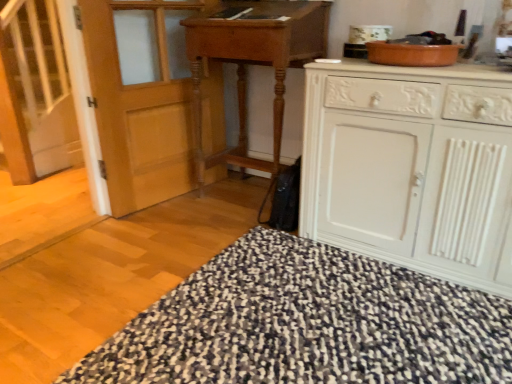
Question: Is the position of wooden table at center more distant than that of white painted wood cabinet at right?

Choices:
 (A) yes
 (B) no

Answer: (A)

Question: Is wooden table at center shorter than white painted wood cabinet at right?

Choices:
 (A) yes
 (B) no

Answer: (B)

Question: Is wooden table at center closer to camera compared to white painted wood cabinet at right?

Choices:
 (A) yes
 (B) no

Answer: (B)

Question: From a real-world perspective, is wooden table at center physically below white painted wood cabinet at right?

Choices:
 (A) yes
 (B) no

Answer: (B)

Question: Is wooden table at center looking in the opposite direction of white painted wood cabinet at right?

Choices:
 (A) yes
 (B) no

Answer: (B)

Question: From a real-world perspective, is wooden table at center over white painted wood cabinet at right?

Choices:
 (A) yes
 (B) no

Answer: (A)

Question: Considering the relative sizes of wooden table at center and white wooden stairs at left in the image provided, is wooden table at center wider than white wooden stairs at left?

Choices:
 (A) yes
 (B) no

Answer: (A)

Question: Does wooden table at center lie behind white wooden stairs at left?

Choices:
 (A) no
 (B) yes

Answer: (A)

Question: From a real-world perspective, is wooden table at center beneath white wooden stairs at left?

Choices:
 (A) no
 (B) yes

Answer: (B)

Question: Is wooden table at center oriented towards white wooden stairs at left?

Choices:
 (A) yes
 (B) no

Answer: (B)

Question: Is wooden table at center placed right next to white wooden stairs at left?

Choices:
 (A) yes
 (B) no

Answer: (B)

Question: Does wooden table at center appear on the right side of white wooden stairs at left?

Choices:
 (A) yes
 (B) no

Answer: (A)

Question: Is black textured rug at lower center a part of white wooden stairs at left?

Choices:
 (A) yes
 (B) no

Answer: (B)